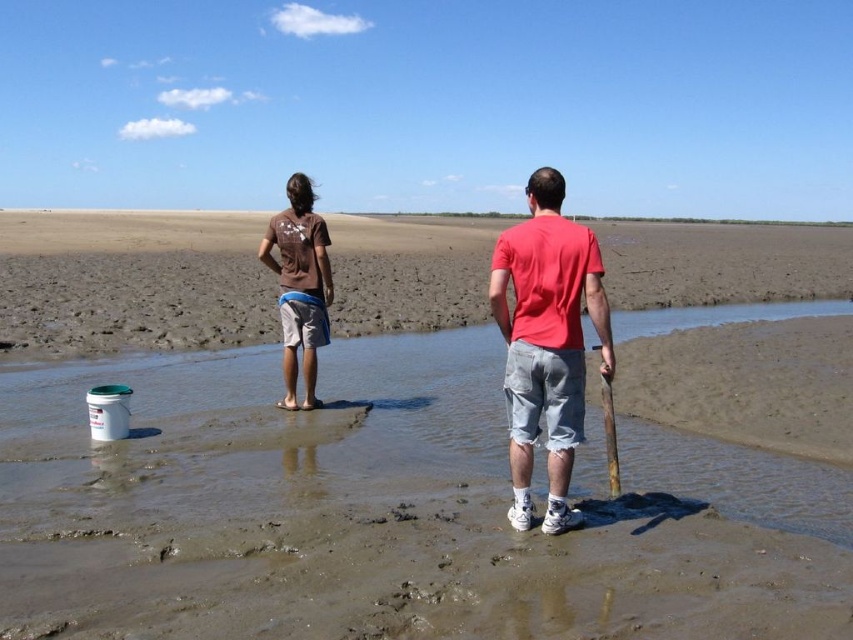
What do you see at coordinates (546, 342) in the screenshot? I see `matte red t-shirt at center` at bounding box center [546, 342].

Measure the distance between matte red t-shirt at center and camera.

matte red t-shirt at center and camera are 3.97 meters apart.

Where is `matte red t-shirt at center`? This screenshot has height=640, width=853. matte red t-shirt at center is located at coordinates (546, 342).

The image size is (853, 640). Find the location of `brown sand at center`. brown sand at center is located at coordinates (393, 508).

Is muddy sand at center above brown cotton shirt at center?

Correct, muddy sand at center is located above brown cotton shirt at center.

The image size is (853, 640). Find the location of `muddy sand at center`. muddy sand at center is located at coordinates (131, 282).